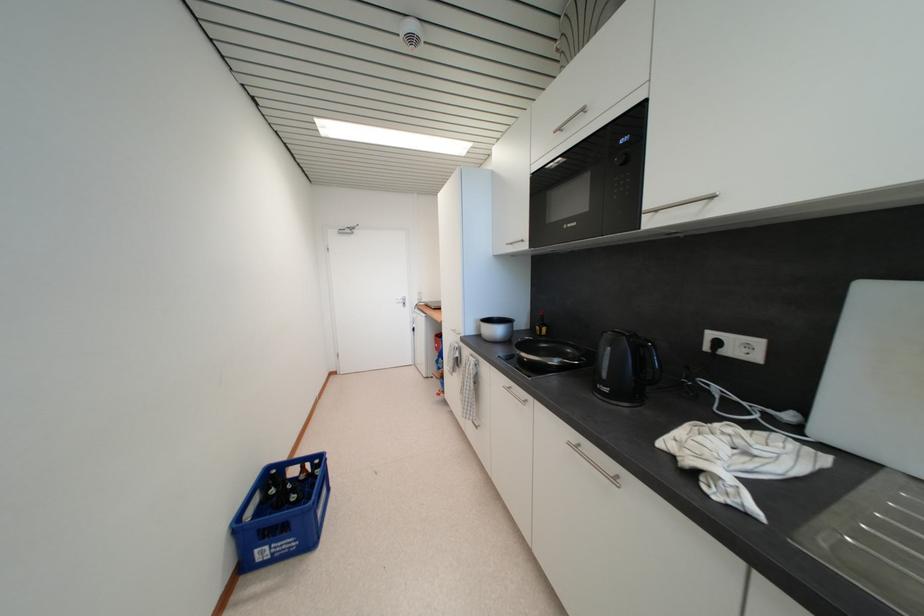
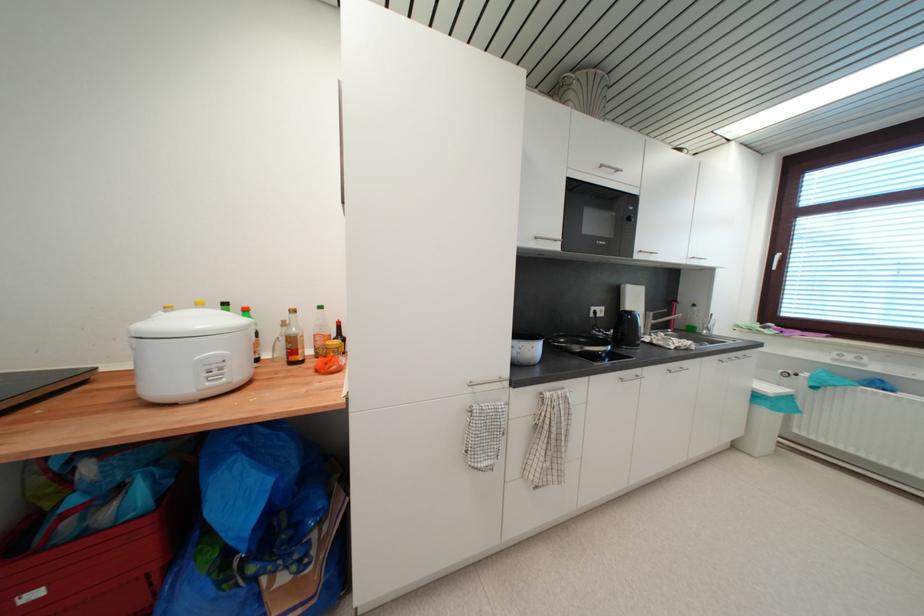
Where in the second image is the point corresponding to the point at 711,351 from the first image?

(597, 317)